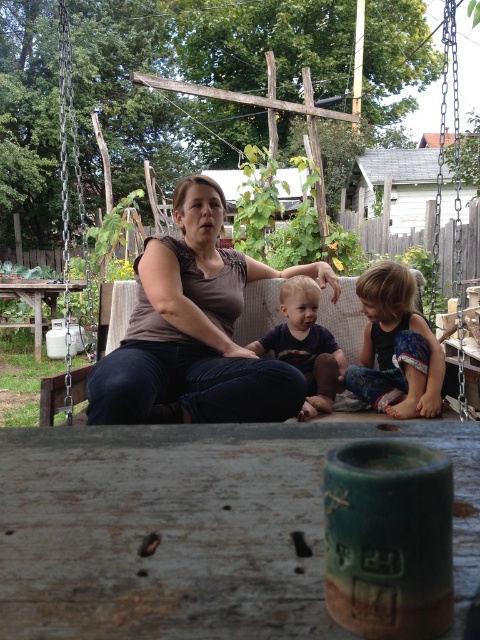
Who is shorter, matte brown tank top at center or wooden swing at center?

Standing shorter between the two is matte brown tank top at center.

Is matte brown tank top at center shorter than wooden swing at center?

Indeed, matte brown tank top at center has a lesser height compared to wooden swing at center.

Is point (175, 300) positioned before point (304, 84)?

Yes, it is.

Identify the location of matte brown tank top at center. (194, 330).

Measure the distance between blonde hair toddler at center and green leafy plant at left.

3.54 meters

Is blonde hair toddler at center behind green leafy plant at left?

No, it is in front of green leafy plant at left.

Is point (272, 336) positioned after point (8, 392)?

No, (272, 336) is closer to viewer.

The height and width of the screenshot is (640, 480). What are the coordinates of `blonde hair toddler at center` in the screenshot? It's located at point(305,346).

Between point (259, 268) and point (28, 406), which one is positioned in front?

Point (259, 268) is more forward.

Can you confirm if wooden swing at center is bigger than green leafy plant at left?

Yes.

Does point (440, 355) come farther from viewer compared to point (56, 360)?

No, (440, 355) is in front of (56, 360).

Find the location of `wooden swing at center`. wooden swing at center is located at coordinates (455, 134).